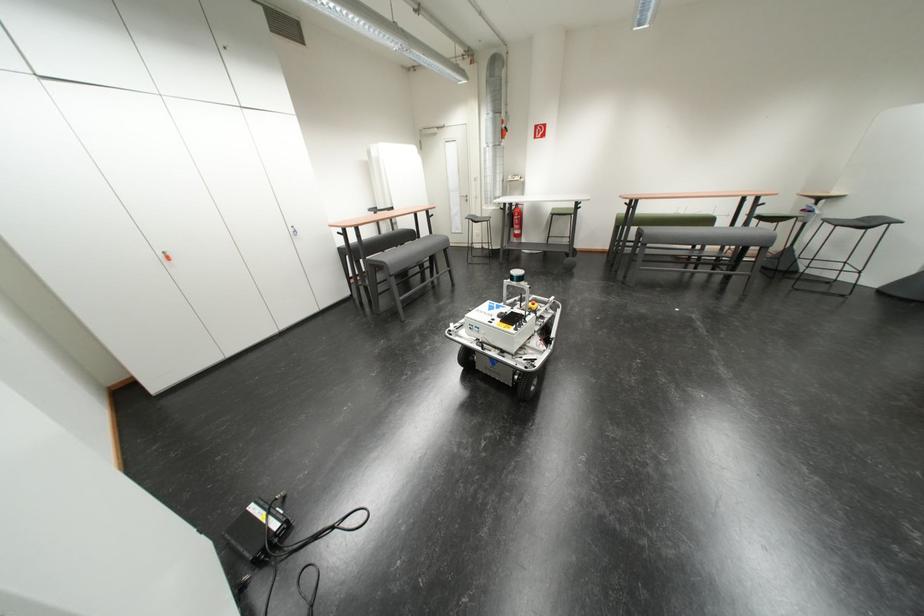
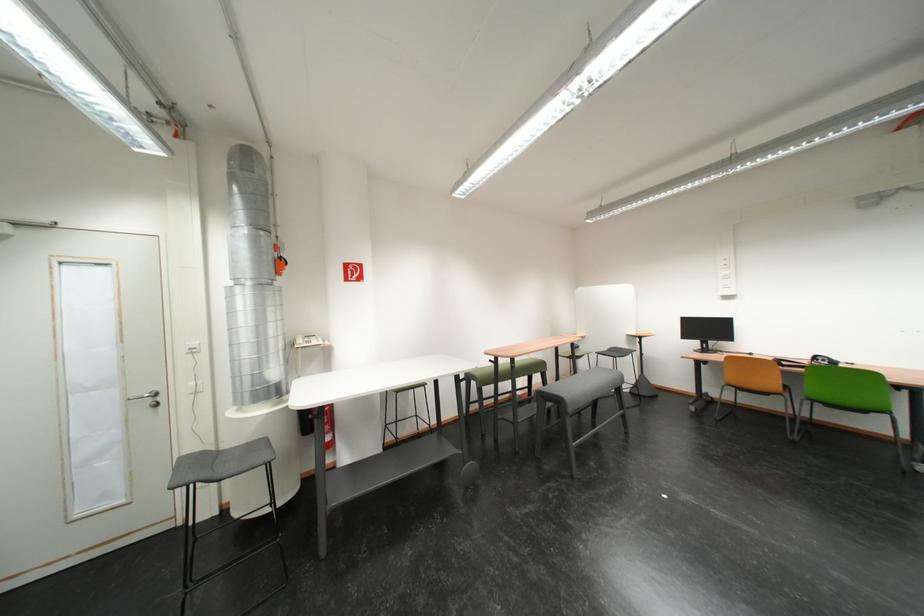
Find the pixel in the second image that matches [472,198] in the first image.

(146, 398)